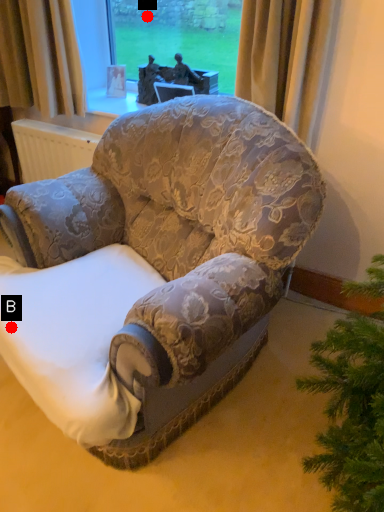
Question: Two points are circled on the image, labeled by A and B beside each circle. Which point appears farthest from the camera in this image?

Choices:
 (A) A is further
 (B) B is further

Answer: (A)